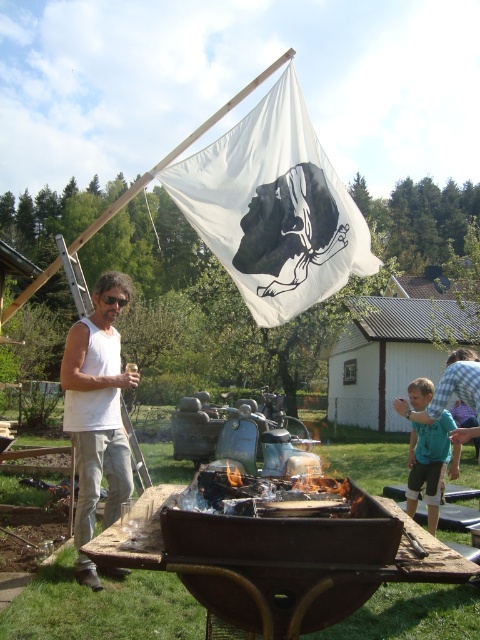
You are standing in the backyard and see the white fabric flag at upper center. If you face the direction the flag is blowing, which direction would you be facing?

The white fabric flag at upper center is located at point (274, 209), but without additional information about wind direction or flag orientation, it is impossible to determine the direction the flag is blowing.

What object is located at the coordinate point (265, 493) in the image?

The charcoal grill at center is located at the coordinate point (265, 493).

You are standing at the barbecue grill in the foreground of the backyard scene. There is a white fabric flag at upper center located at point (274, 209). If you look straight ahead, will the white fabric flag at upper center be in your field of view?

The white fabric flag at upper center is located at point (274, 209), which is in the upper center of the scene. Since you are standing at the barbecue grill in the foreground, looking straight ahead would naturally include the upper center area of the scene, so yes, the flag would be in your field of view.